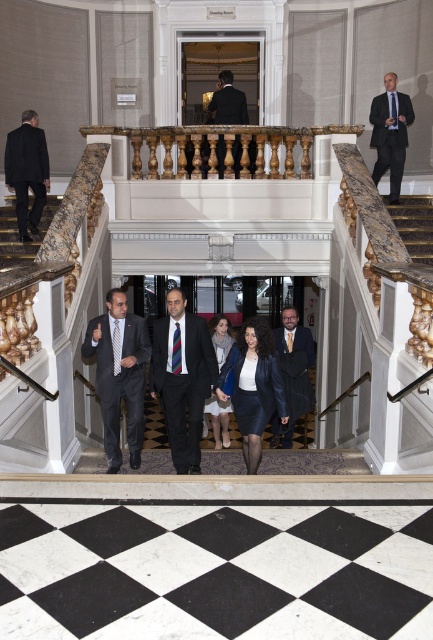
Question: Is matte black suit at center smaller than matte black suit at left?

Choices:
 (A) no
 (B) yes

Answer: (A)

Question: Can you confirm if marble stairs at lower left is positioned below black matte suit at upper center?

Choices:
 (A) no
 (B) yes

Answer: (B)

Question: Which point is farther to the camera?

Choices:
 (A) (19, 241)
 (B) (300, 396)
 (C) (129, 372)

Answer: (A)

Question: Among these points, which one is farthest from the camera?

Choices:
 (A) (239, 93)
 (B) (31, 204)

Answer: (A)

Question: Among these points, which one is nearest to the camera?

Choices:
 (A) (407, 99)
 (B) (38, 205)

Answer: (B)

Question: Can you confirm if matte black suit at center is positioned below marble stairs at lower left?

Choices:
 (A) no
 (B) yes

Answer: (B)